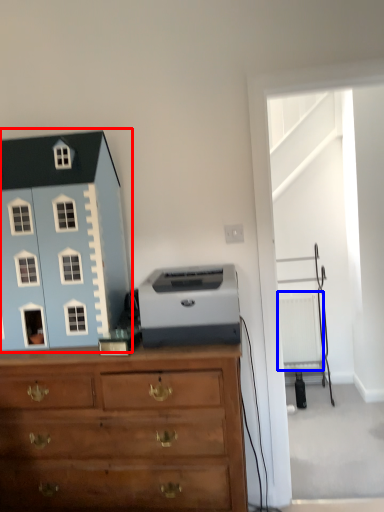
Question: Which object appears closest to the camera in this image, toy (highlighted by a red box) or radiator (highlighted by a blue box)?

Choices:
 (A) toy
 (B) radiator

Answer: (A)